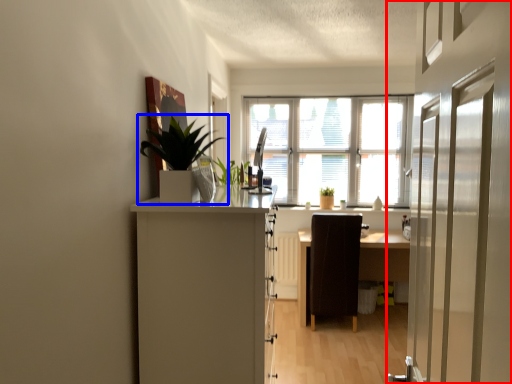
Question: Which object is closer to the camera taking this photo, door (highlighted by a red box) or houseplant (highlighted by a blue box)?

Choices:
 (A) door
 (B) houseplant

Answer: (A)